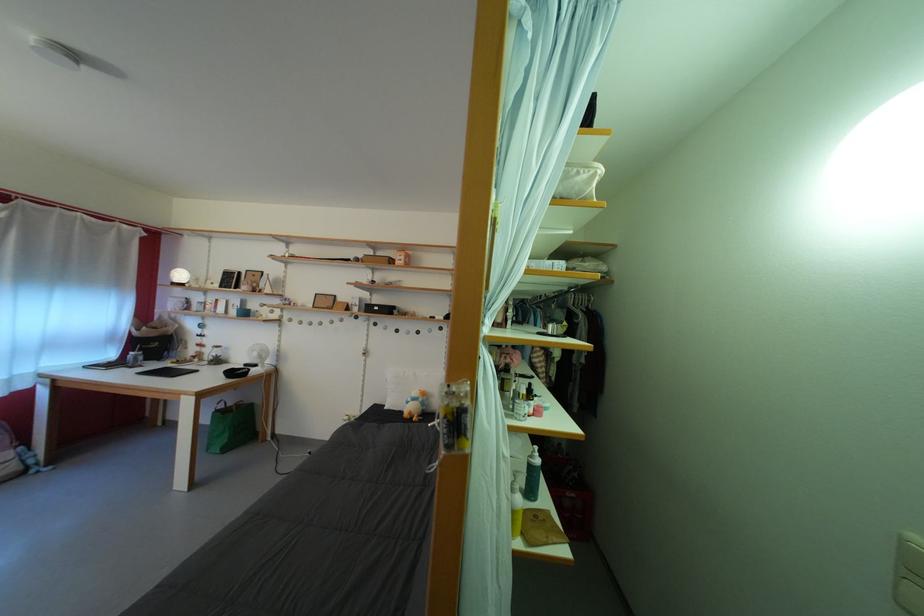
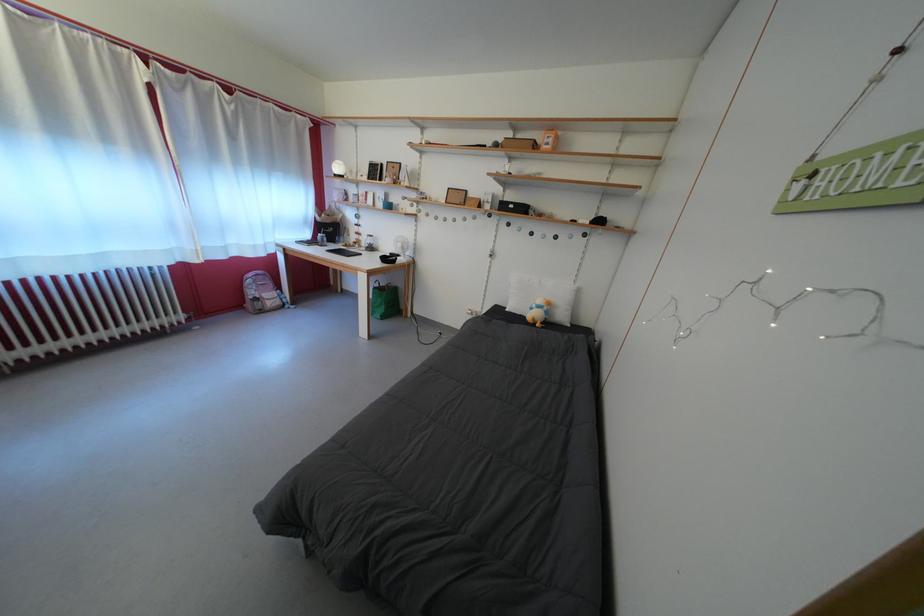
Find the pixel in the second image that matches (x=387, y=259) in the first image.

(527, 142)